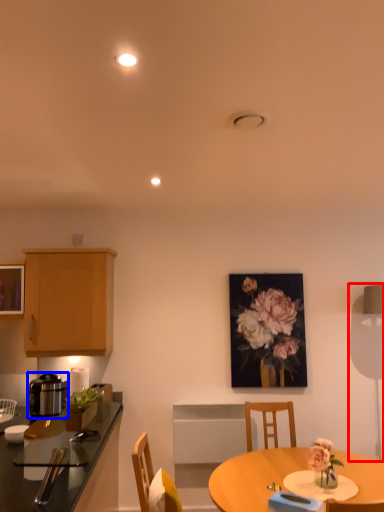
Question: Which object is further to the camera taking this photo, table lamp (highlighted by a red box) or kitchen appliance (highlighted by a blue box)?

Choices:
 (A) table lamp
 (B) kitchen appliance

Answer: (A)